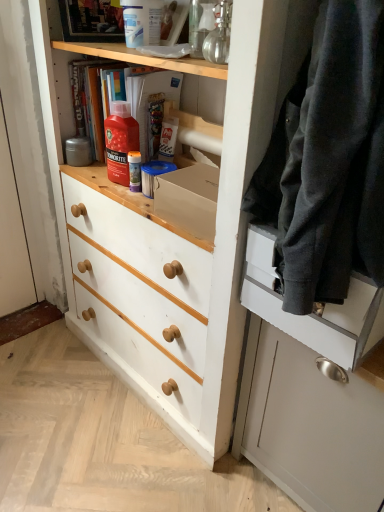
Question: Is dark gray wool sweater at right inside satin white cabinet at right?

Choices:
 (A) yes
 (B) no

Answer: (B)

Question: Could you tell me if satin white cabinet at right is turned towards dark gray wool sweater at right?

Choices:
 (A) no
 (B) yes

Answer: (A)

Question: Can you confirm if satin white cabinet at right is shorter than dark gray wool sweater at right?

Choices:
 (A) yes
 (B) no

Answer: (B)

Question: Is satin white cabinet at right wider than dark gray wool sweater at right?

Choices:
 (A) yes
 (B) no

Answer: (B)

Question: From a real-world perspective, is satin white cabinet at right positioned over dark gray wool sweater at right based on gravity?

Choices:
 (A) no
 (B) yes

Answer: (A)

Question: Do you think matte black drawer at right is within satin white cabinet at right, or outside of it?

Choices:
 (A) outside
 (B) inside

Answer: (A)

Question: Is matte black drawer at right wider or thinner than satin white cabinet at right?

Choices:
 (A) thin
 (B) wide

Answer: (B)

Question: Considering the positions of matte black drawer at right and satin white cabinet at right in the image, is matte black drawer at right bigger or smaller than satin white cabinet at right?

Choices:
 (A) small
 (B) big

Answer: (A)

Question: Relative to satin white cabinet at right, is matte black drawer at right in front or behind?

Choices:
 (A) front
 (B) behind

Answer: (A)

Question: From a real-world perspective, relative to dark gray wool sweater at right, is matte black drawer at right vertically above or below?

Choices:
 (A) above
 (B) below

Answer: (B)

Question: Based on their positions, is matte black drawer at right located to the left or right of dark gray wool sweater at right?

Choices:
 (A) right
 (B) left

Answer: (A)

Question: From the image's perspective, is matte black drawer at right positioned above or below dark gray wool sweater at right?

Choices:
 (A) above
 (B) below

Answer: (B)

Question: Considering the positions of matte black drawer at right and dark gray wool sweater at right in the image, is matte black drawer at right wider or thinner than dark gray wool sweater at right?

Choices:
 (A) wide
 (B) thin

Answer: (B)

Question: From the image's perspective, is satin white cabinet at right above or below white painted wood chest of drawers at center?

Choices:
 (A) above
 (B) below

Answer: (B)

Question: From a real-world perspective, is satin white cabinet at right above or below white painted wood chest of drawers at center?

Choices:
 (A) above
 (B) below

Answer: (B)